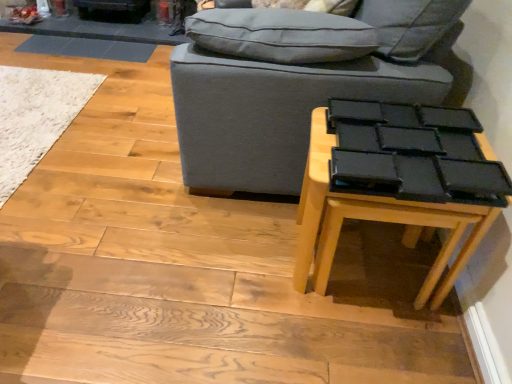
Where is `black matte table at lower right`? The height and width of the screenshot is (384, 512). black matte table at lower right is located at coordinates (362, 200).

Identify the location of gray fabric studio couch at center. Image resolution: width=512 pixels, height=384 pixels. point(295,82).

Is black matte table at lower right outside of white shaggy rug at lower left?

black matte table at lower right lies outside white shaggy rug at lower left's area.

Which is behind, point (467, 248) or point (14, 125)?

The point (14, 125) is more distant.

Is black matte table at lower right next to white shaggy rug at lower left and touching it?

There is a gap between black matte table at lower right and white shaggy rug at lower left.

Which is farther, (61, 82) or (313, 118)?

The point (61, 82) is farther from the camera.

In the image, is white shaggy rug at lower left on the left side or the right side of black matte table at lower right?

From the image, it's evident that white shaggy rug at lower left is to the left of black matte table at lower right.

Is there a large distance between white shaggy rug at lower left and black matte table at lower right?

Indeed, white shaggy rug at lower left is not near black matte table at lower right.

Can you confirm if white shaggy rug at lower left is bigger than black matte table at lower right?

No.

Who is more distant, gray fabric studio couch at center or white shaggy rug at lower left?

white shaggy rug at lower left.

Does gray fabric studio couch at center have a larger size compared to white shaggy rug at lower left?

Indeed, gray fabric studio couch at center has a larger size compared to white shaggy rug at lower left.

Could you tell me if gray fabric studio couch at center is facing white shaggy rug at lower left?

Yes, gray fabric studio couch at center is turned towards white shaggy rug at lower left.

Is white shaggy rug at lower left spatially inside gray fabric studio couch at center, or outside of it?

white shaggy rug at lower left is outside gray fabric studio couch at center.

From a real-world perspective, is white shaggy rug at lower left positioned above or below gray fabric studio couch at center?

In terms of real-world spatial position, white shaggy rug at lower left is below gray fabric studio couch at center.

Which object is positioned more to the left, white shaggy rug at lower left or gray fabric studio couch at center?

white shaggy rug at lower left is more to the left.

This screenshot has height=384, width=512. I want to click on studio couch above the white shaggy rug at lower left (from a real-world perspective), so click(x=295, y=82).

From the picture: Is gray fabric studio couch at center wider than black matte table at lower right?

Yes, gray fabric studio couch at center is wider than black matte table at lower right.

Is gray fabric studio couch at center located outside black matte table at lower right?

gray fabric studio couch at center lies outside black matte table at lower right's area.

Is gray fabric studio couch at center taller or shorter than black matte table at lower right?

gray fabric studio couch at center is taller than black matte table at lower right.

Consider the image. Between black matte table at lower right and gray fabric studio couch at center, which one has less height?

With less height is black matte table at lower right.

Considering the relative positions of black matte table at lower right and gray fabric studio couch at center in the image provided, is black matte table at lower right to the right of gray fabric studio couch at center from the viewer's perspective?

Indeed, black matte table at lower right is positioned on the right side of gray fabric studio couch at center.

Is black matte table at lower right facing away from gray fabric studio couch at center?

No, gray fabric studio couch at center is not at the back of black matte table at lower right.

Identify the location of table in front of the white shaggy rug at lower left. (362, 200).

Where is `table on the right of white shaggy rug at lower left`? table on the right of white shaggy rug at lower left is located at coordinates (362, 200).

From the image, which object appears to be farther from gray fabric studio couch at center, white shaggy rug at lower left or black matte table at lower right?

white shaggy rug at lower left is further to gray fabric studio couch at center.

Estimate the real-world distances between objects in this image. Which object is further from white shaggy rug at lower left, black matte table at lower right or gray fabric studio couch at center?

Among the two, black matte table at lower right is located further to white shaggy rug at lower left.

Which object lies further to the anchor point black matte table at lower right, gray fabric studio couch at center or white shaggy rug at lower left?

white shaggy rug at lower left.

Based on their spatial positions, is white shaggy rug at lower left or gray fabric studio couch at center further from black matte table at lower right?

white shaggy rug at lower left.

Consider the image. From the image, which object appears to be nearer to gray fabric studio couch at center, black matte table at lower right or white shaggy rug at lower left?

black matte table at lower right.

Which object lies further to the anchor point white shaggy rug at lower left, gray fabric studio couch at center or black matte table at lower right?

Among the two, black matte table at lower right is located further to white shaggy rug at lower left.

Where is `studio couch between white shaggy rug at lower left and black matte table at lower right in the horizontal direction`? This screenshot has height=384, width=512. studio couch between white shaggy rug at lower left and black matte table at lower right in the horizontal direction is located at coordinates (295, 82).